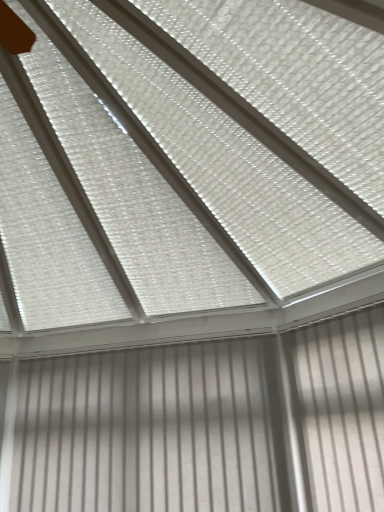
Measure the distance between point (59, 460) and camera.

The depth of point (59, 460) is 7.67 feet.

This screenshot has height=512, width=384. Identify the location of metallic silver window frame at bottom. (152, 430).

This screenshot has width=384, height=512. What do you see at coordinates (152, 430) in the screenshot?
I see `metallic silver window frame at bottom` at bounding box center [152, 430].

What is the approximate height of metallic silver window frame at bottom?

The height of metallic silver window frame at bottom is 34.53 inches.

Where is `metallic silver window frame at bottom`? The height and width of the screenshot is (512, 384). metallic silver window frame at bottom is located at coordinates (152, 430).